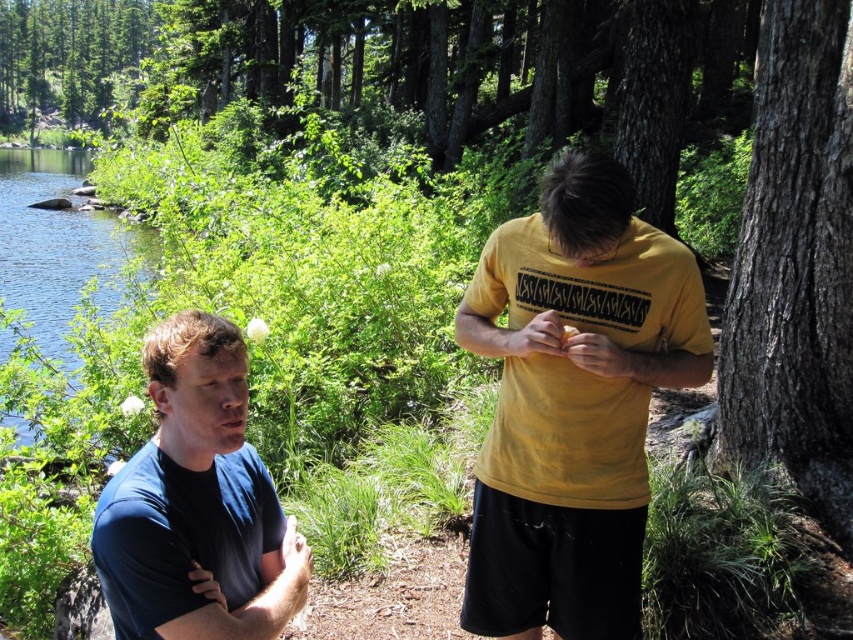
You are a photographer trying to capture a photo of the yellow matte shirt at right and the blue water at left. Based on their positions, which object is located to the right of the other?

The yellow matte shirt at right is positioned on the right side of the blue water at left.

You are standing at the origin point in the scene. There is a point marked at coordinates (573, 403). What object is located at that point?

The point at coordinates (573, 403) corresponds to the yellow matte shirt at right.

You are standing in the middle of the scene and want to locate the smooth bark tree at right. According to the coordinates provided, in which direction should you look to find it?

The smooth bark tree at right is located at coordinates 0.414 on the x axis and 0.933 on the y axis. Since the coordinate system is normalized, (0, 0) is the bottom left corner and (852, 639) is the top right corner. Therefore, to locate the smooth bark tree at right, you should look towards the upper right direction from your current position in the middle of the scene.